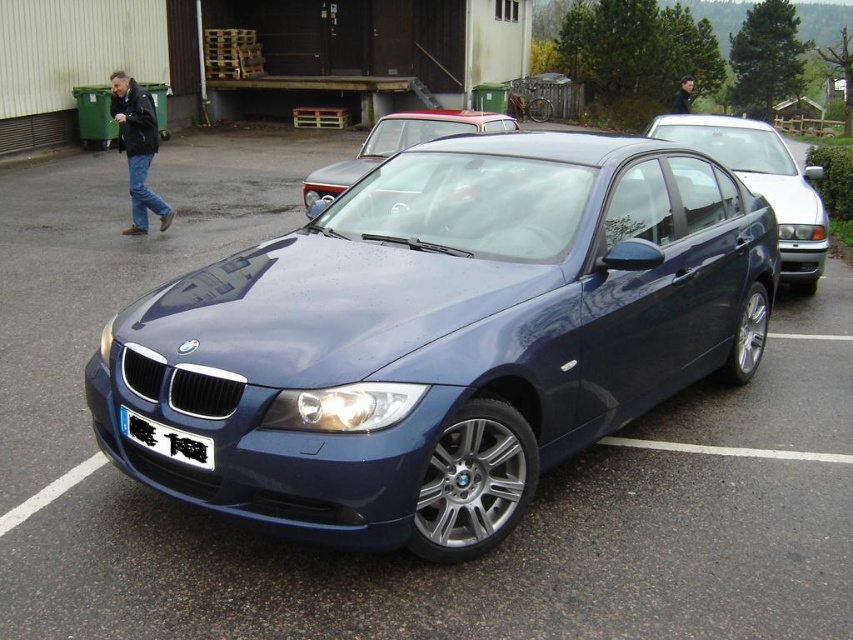
Does satin blue sedan at right appear on the right side of matte black car at left?

Indeed, satin blue sedan at right is positioned on the right side of matte black car at left.

Between satin blue sedan at right and matte black car at left, which one appears on the left side from the viewer's perspective?

Positioned to the left is matte black car at left.

Measure the distance between satin blue sedan at right and camera.

5.43 meters

I want to click on satin blue sedan at right, so click(x=763, y=182).

Between matte black car at left and white plastic license plate at center, which one is positioned lower?

Positioned lower is white plastic license plate at center.

Can you confirm if matte black car at left is bigger than white plastic license plate at center?

Yes.

Describe the element at coordinates (137, 148) in the screenshot. The width and height of the screenshot is (853, 640). I see `matte black car at left` at that location.

At what (x,y) coordinates should I click in order to perform the action: click on matte black car at left. Please return your answer as a coordinate pair (x, y). This screenshot has width=853, height=640. Looking at the image, I should click on (137, 148).

What do you see at coordinates (763, 182) in the screenshot? This screenshot has height=640, width=853. I see `satin blue sedan at right` at bounding box center [763, 182].

Which is more to the right, satin blue sedan at right or glossy metallic car at center?

From the viewer's perspective, satin blue sedan at right appears more on the right side.

Between point (755, 140) and point (305, 205), which one is positioned behind?

Positioned behind is point (305, 205).

This screenshot has width=853, height=640. Identify the location of satin blue sedan at right. (763, 182).